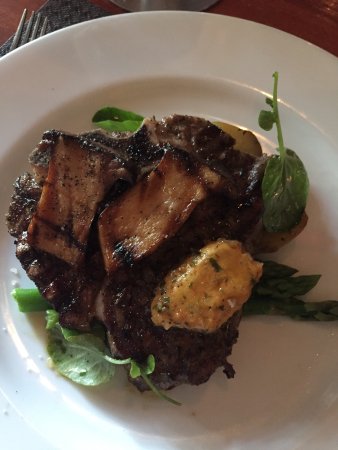
The height and width of the screenshot is (450, 338). What are the coordinates of `plate` in the screenshot? It's located at (76, 414).